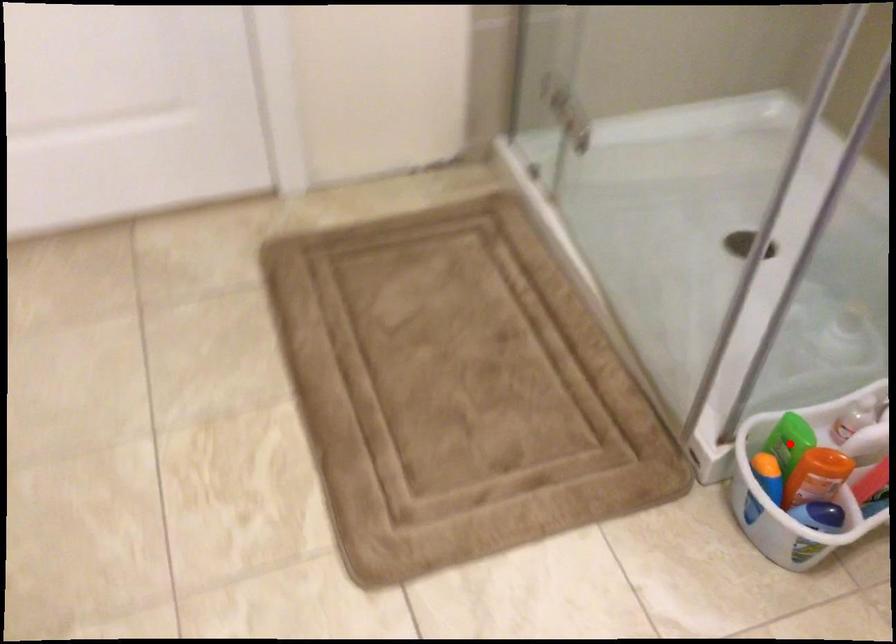
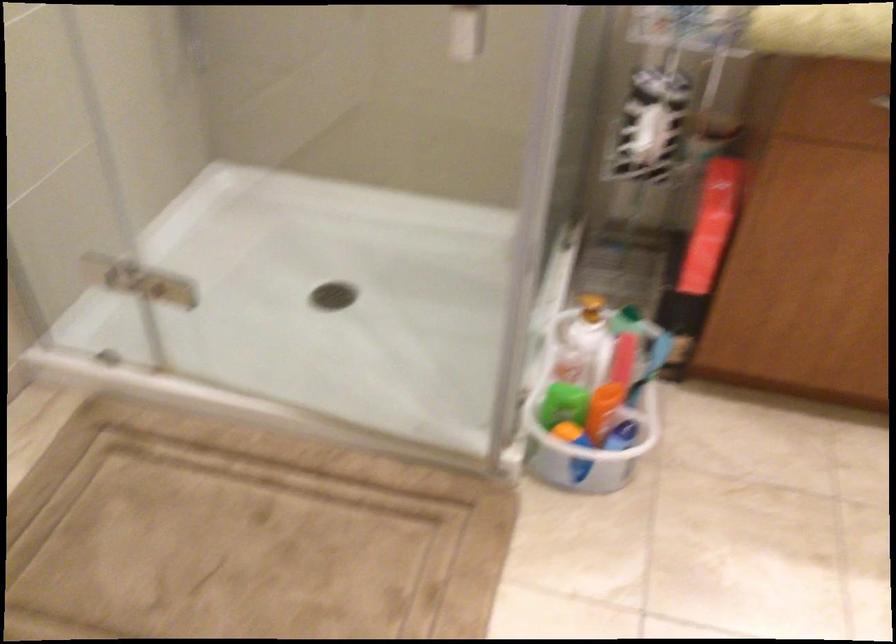
Where in the second image is the point corresponding to the highlighted location from the first image?

(563, 402)